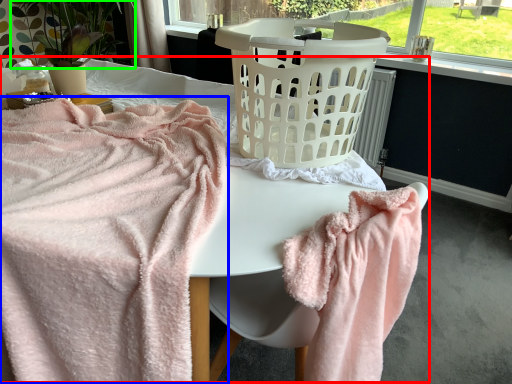
Question: Based on their relative distances, which object is nearer to bed (highlighted by a red box)? Choose from towel (highlighted by a blue box) and plant (highlighted by a green box).

Choices:
 (A) towel
 (B) plant

Answer: (A)